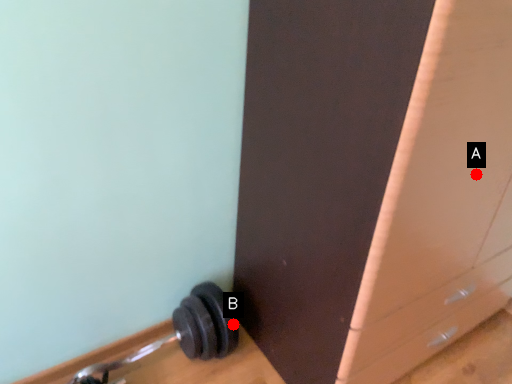
Question: Two points are circled on the image, labeled by A and B beside each circle. Which of the following is the closest to the observer?

Choices:
 (A) A is closer
 (B) B is closer

Answer: (A)